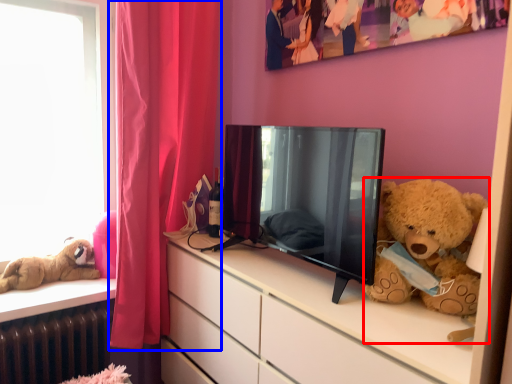
Question: Which object is closer to the camera taking this photo, teddy bear (highlighted by a red box) or curtain (highlighted by a blue box)?

Choices:
 (A) teddy bear
 (B) curtain

Answer: (A)